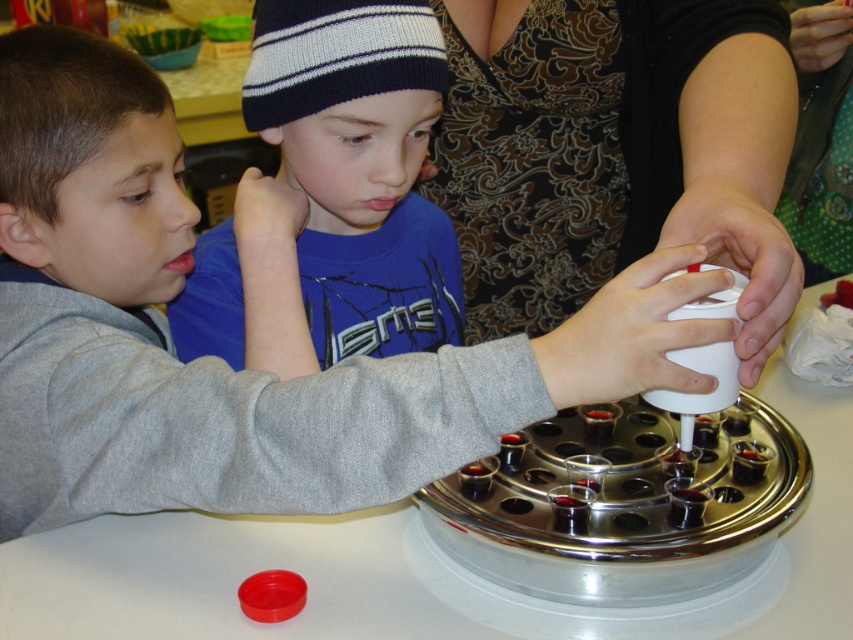
Question: In this image, where is smooth white cup at center located relative to blue knit hat at upper center?

Choices:
 (A) left
 (B) right

Answer: (A)

Question: Which point is closer to the camera?

Choices:
 (A) (502, 300)
 (B) (59, 216)

Answer: (B)

Question: Is patterned fabric dress at upper center bigger than blue knit hat at upper center?

Choices:
 (A) no
 (B) yes

Answer: (B)

Question: Is smooth white cup at center further to the viewer compared to patterned fabric dress at upper center?

Choices:
 (A) no
 (B) yes

Answer: (A)

Question: Which object appears closest to the camera in this image?

Choices:
 (A) smooth white cup at center
 (B) patterned fabric dress at upper center
 (C) blue knit hat at upper center

Answer: (A)

Question: Estimate the real-world distances between objects in this image. Which object is closer to the blue knit hat at upper center?

Choices:
 (A) smooth white cup at center
 (B) patterned fabric dress at upper center

Answer: (A)